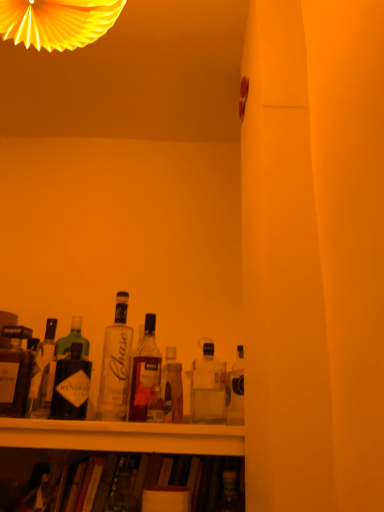
Question: Is clear glass bottle at center, which is the 3th bottle from left to right, surrounding matte black bottle at left, the 1th bottle viewed from the left?

Choices:
 (A) yes
 (B) no

Answer: (B)

Question: Does clear glass bottle at center, the fourth bottle in the right-to-left sequence, have a lesser height compared to matte black bottle at left, marked as the 6th bottle in a right-to-left arrangement?

Choices:
 (A) no
 (B) yes

Answer: (A)

Question: From the image's perspective, would you say clear glass bottle at center, which is the 3th bottle from left to right, is shown under matte black bottle at left, marked as the 6th bottle in a right-to-left arrangement?

Choices:
 (A) yes
 (B) no

Answer: (B)

Question: Is clear glass bottle at center, the fourth bottle in the right-to-left sequence, oriented towards matte black bottle at left, the 1th bottle viewed from the left?

Choices:
 (A) no
 (B) yes

Answer: (A)

Question: From the image's perspective, is clear glass bottle at center, the fourth bottle in the right-to-left sequence, over matte black bottle at left, marked as the 6th bottle in a right-to-left arrangement?

Choices:
 (A) yes
 (B) no

Answer: (A)

Question: Can you see clear glass bottle at center, the fourth bottle in the right-to-left sequence, touching matte black bottle at left, the 1th bottle viewed from the left?

Choices:
 (A) no
 (B) yes

Answer: (A)

Question: Is matte black bottle at left, the 1th bottle viewed from the left, to the right of translucent glass bottle at center, acting as the third bottle starting from the right, from the viewer's perspective?

Choices:
 (A) yes
 (B) no

Answer: (B)

Question: Is the depth of matte black bottle at left, the 1th bottle viewed from the left, greater than that of translucent glass bottle at center, acting as the third bottle starting from the right?

Choices:
 (A) no
 (B) yes

Answer: (A)

Question: From the image's perspective, is matte black bottle at left, the 1th bottle viewed from the left, located beneath translucent glass bottle at center, marked as the 4th bottle in a left-to-right arrangement?

Choices:
 (A) no
 (B) yes

Answer: (A)

Question: From a real-world perspective, is matte black bottle at left, the 1th bottle viewed from the left, positioned under translucent glass bottle at center, acting as the third bottle starting from the right, based on gravity?

Choices:
 (A) no
 (B) yes

Answer: (B)

Question: Is matte black bottle at left, marked as the 6th bottle in a right-to-left arrangement, placed right next to translucent glass bottle at center, acting as the third bottle starting from the right?

Choices:
 (A) no
 (B) yes

Answer: (A)

Question: Is matte black bottle at left, marked as the 6th bottle in a right-to-left arrangement, wider than translucent glass bottle at center, acting as the third bottle starting from the right?

Choices:
 (A) no
 (B) yes

Answer: (B)

Question: From the image's perspective, is translucent glass bottle at center, acting as the third bottle starting from the right, over matte black bottle at left, the 1th bottle viewed from the left?

Choices:
 (A) no
 (B) yes

Answer: (A)